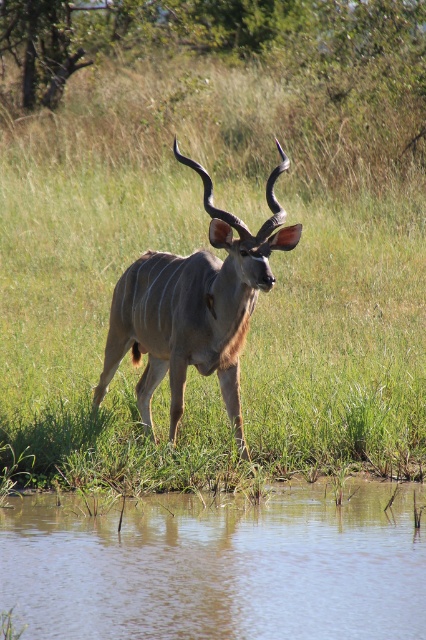
Question: Which point is farther from the camera taking this photo?

Choices:
 (A) (224, 308)
 (B) (310, 413)

Answer: (B)

Question: Is brown muddy water at lower center to the right of brown textured antelope at center from the viewer's perspective?

Choices:
 (A) yes
 (B) no

Answer: (A)

Question: From the image, what is the correct spatial relationship of green grass at center in relation to brown textured antelope at center?

Choices:
 (A) left
 (B) right

Answer: (A)

Question: Is green grass at center thinner than brown textured antelope at center?

Choices:
 (A) no
 (B) yes

Answer: (A)

Question: Among these objects, which one is nearest to the camera?

Choices:
 (A) brown textured antelope at center
 (B) brown muddy water at lower center
 (C) green grass at center

Answer: (B)

Question: Among these points, which one is farthest from the camera?

Choices:
 (A) (249, 291)
 (B) (42, 396)

Answer: (B)